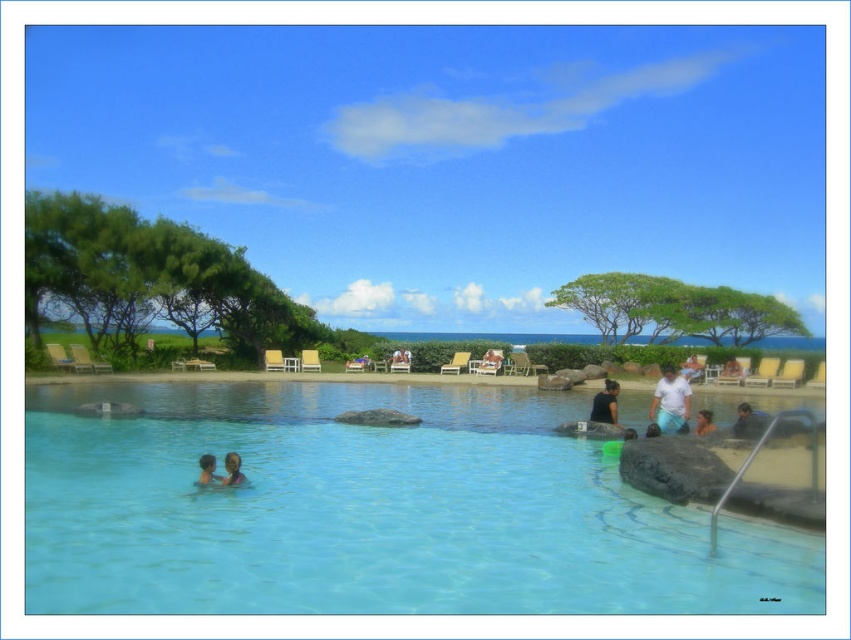
Can you confirm if clear blue water at center is taller than black matte shirt at center?

Yes.

Does clear blue water at center have a lesser height compared to black matte shirt at center?

In fact, clear blue water at center may be taller than black matte shirt at center.

Identify the location of clear blue water at center. (368, 509).

Does white cotton shirt at upper right appear over smooth skin head at lower left?

Yes, white cotton shirt at upper right is above smooth skin head at lower left.

Locate an element on the screen. The height and width of the screenshot is (640, 851). white cotton shirt at upper right is located at coordinates (670, 401).

Between point (660, 388) and point (213, 464), which one is positioned in front?

Positioned in front is point (213, 464).

You are a GUI agent. You are given a task and a screenshot of the screen. Output one action in this format:
    pyautogui.click(x=<x>, y=<y>)
    Task: Click on the white cotton shirt at upper right
    The image size is (851, 640).
    Given the screenshot: What is the action you would take?
    pyautogui.click(x=670, y=401)

Does point (195, 483) come behind point (709, 429)?

No, (195, 483) is closer to viewer.

Find the location of `smooth skin head at lower left`. smooth skin head at lower left is located at coordinates (207, 470).